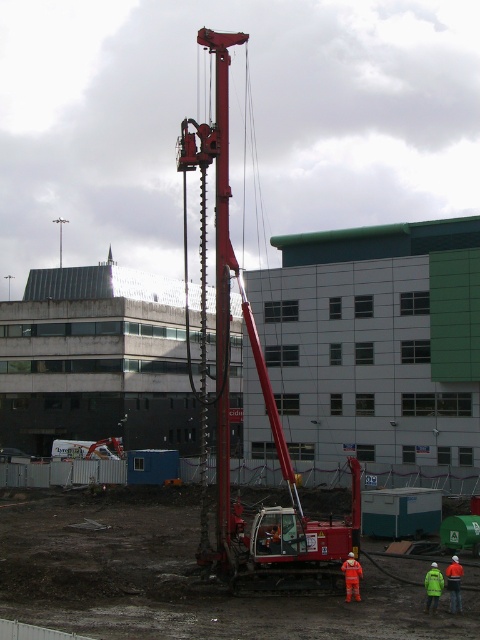
Question: In this image, where is orange reflective safety vest at lower right located relative to high visibility jacket at lower right?

Choices:
 (A) above
 (B) below

Answer: (B)

Question: Which object is the farthest from the teal matte container at center?

Choices:
 (A) matte red crane at center
 (B) orange reflective vest at lower right

Answer: (B)

Question: Considering the relative positions of matte red crane at center and orange reflective safety vest at lower right in the image provided, where is matte red crane at center located with respect to orange reflective safety vest at lower right?

Choices:
 (A) right
 (B) left

Answer: (B)

Question: Estimate the real-world distances between objects in this image. Which object is closer to the high visibility jacket at lower right?

Choices:
 (A) teal matte container at center
 (B) orange reflective vest at lower right
 (C) matte red crane at center
 (D) orange reflective safety vest at lower right

Answer: (D)

Question: Is teal matte container at center wider than orange reflective vest at lower right?

Choices:
 (A) yes
 (B) no

Answer: (B)

Question: Which of these objects is positioned farthest from the orange reflective safety vest at lower right?

Choices:
 (A) orange reflective vest at lower right
 (B) high visibility jacket at lower right
 (C) teal matte container at center
 (D) matte red crane at center

Answer: (C)